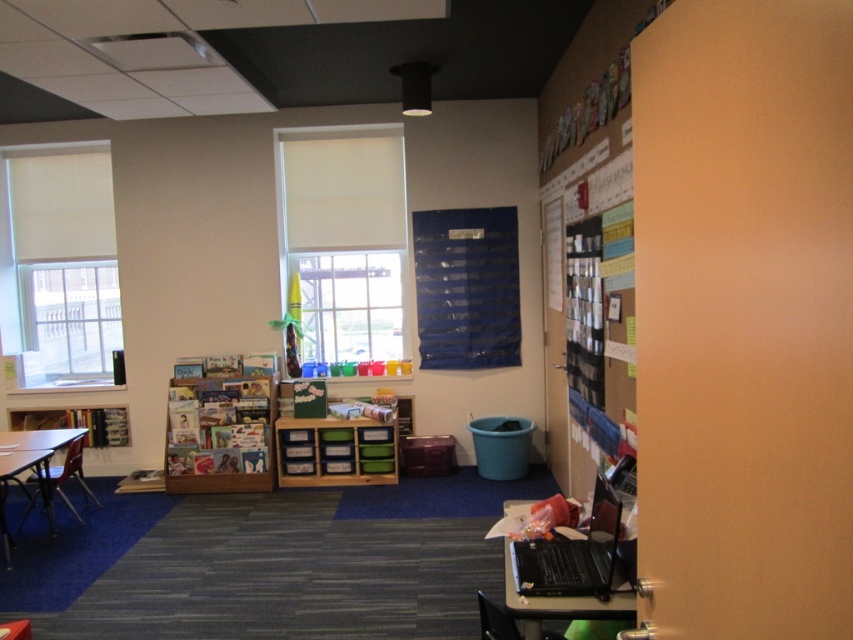
You are standing at the center of the classroom. You need to move to the black plastic computer desk at lower right. Which direction should you walk to reach it?

Since the black plastic computer desk at lower right is located at coordinates point (x=569, y=605), you should walk towards the lower right direction to reach it.

You are standing in the classroom and want to hang a poster on the wall. The bulletin board is located at point [589,305]. Can you reach the bulletin board easily?

The bulletin board at right is marked by point [589,305], so yes, you can reach it easily.